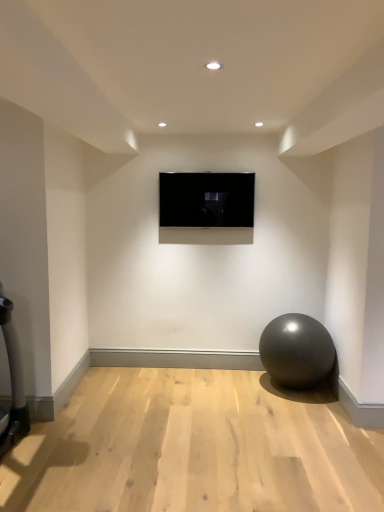
This screenshot has height=512, width=384. In order to click on empty space that is ontop of matte black screen at center (from a real-world perspective) in this screenshot , I will do `click(217, 168)`.